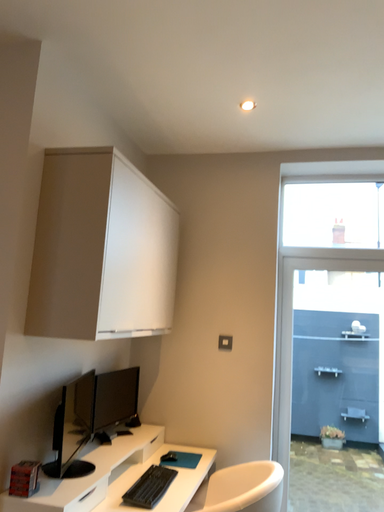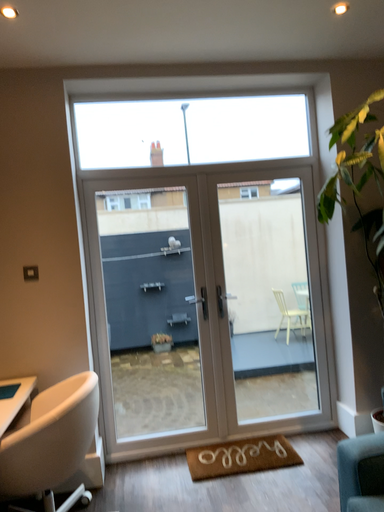
Question: How did the camera likely rotate when shooting the video?

Choices:
 (A) rotated left
 (B) rotated right

Answer: (B)